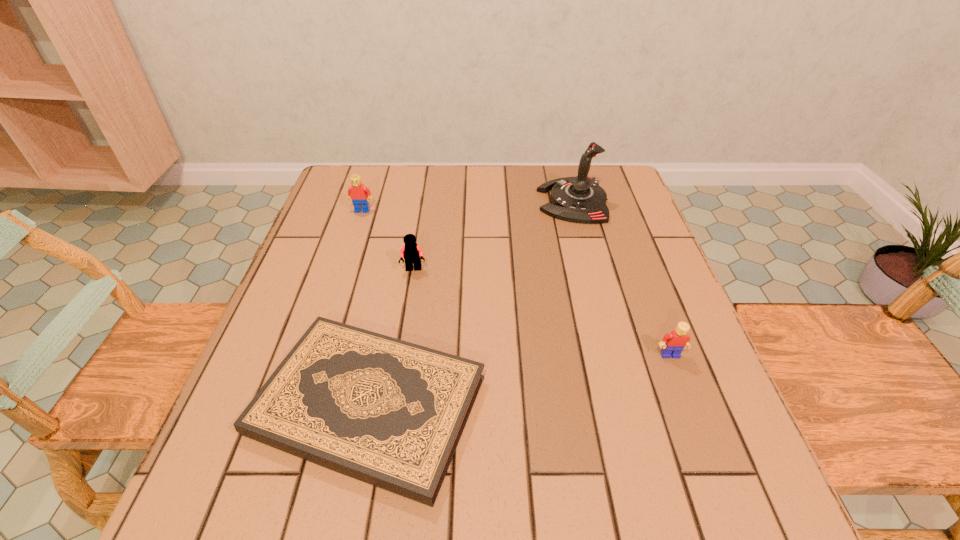
This screenshot has height=540, width=960. Find the location of `the tallest object`. the tallest object is located at coordinates (580, 199).

Locate an element on the screen. the farthest Lego is located at coordinates (359, 194).

Image resolution: width=960 pixels, height=540 pixels. I want to click on the second nearest Lego, so click(x=412, y=253).

At what (x,y) coordinates should I click in order to perform the action: click on the third nearest object. Please return your answer as a coordinate pair (x, y). This screenshot has height=540, width=960. Looking at the image, I should click on (412, 253).

This screenshot has height=540, width=960. Identify the location of the rightmost Lego. (672, 344).

The image size is (960, 540). In order to click on hardback book in this screenshot , I will do (390, 413).

You are a GUI agent. You are given a task and a screenshot of the screen. Output one action in this format:
    pyautogui.click(x=<x>, y=<y>)
    Task: Click on the vacant space situated on the handle side of the tallest object
    This screenshot has height=540, width=960.
    Given the screenshot: What is the action you would take?
    pyautogui.click(x=505, y=201)

The width and height of the screenshot is (960, 540). What are the coordinates of `vacant area situated 0.050m on the handle side of the tallest object` in the screenshot? It's located at (519, 201).

Locate an element on the screen. This screenshot has height=540, width=960. free spot located 0.100m on the handle side of the tallest object is located at coordinates 501,201.

The width and height of the screenshot is (960, 540). Find the location of `free space located on the face of the farthest Lego`. free space located on the face of the farthest Lego is located at coordinates (336, 292).